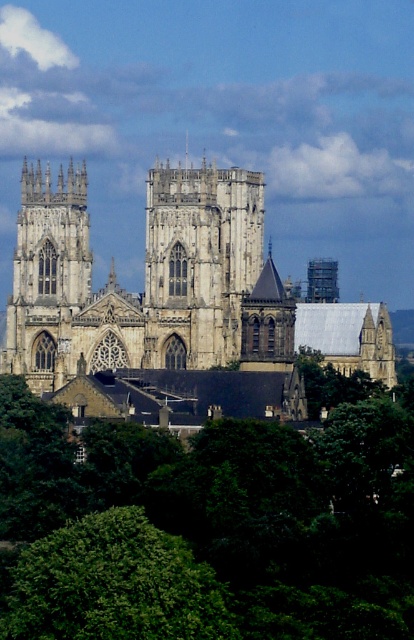
From the picture: You are standing in front of the cathedral and want to take a photo of the white stone tower at center without the green leafy tree at lower center blocking it. Which direction should you move to ensure the tree is out of frame?

Move to the left side of the white stone tower at center so that the green leafy tree at lower center, which is on its right, will be out of the frame.

You are an architect evaluating the cathedral for a restoration project. You notice the stone church at center and the white stone tower at center. Which structure has a greater width according to the provided information?

The stone church at center has a greater width than the white stone tower at center.